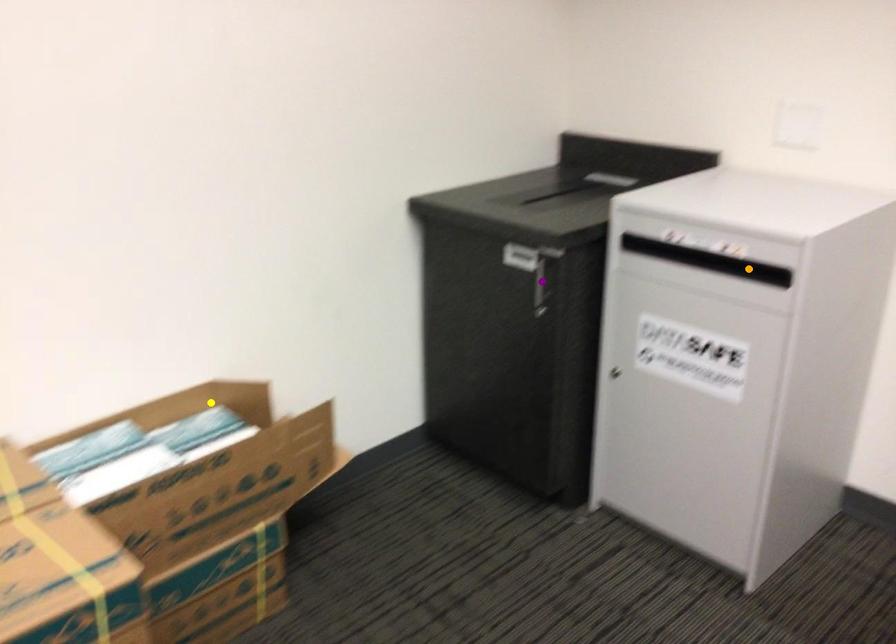
Order these from nearest to farthest:
yellow point, purple point, orange point

purple point
yellow point
orange point